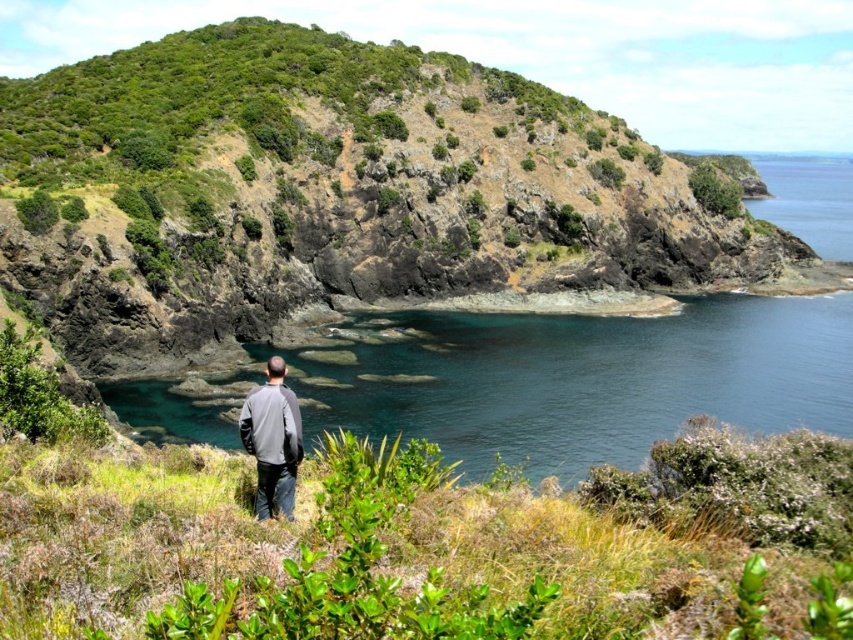
You are a photographer trying to capture the entire scene in one shot. Given that the gray fleece jacket at center and the green leafy shrub at upper center are in your frame, which object appears smaller in the photo?

The gray fleece jacket at center appears smaller than the green leafy shrub at upper center in the photo.

You are a photographer planning to capture the clear blue water at center and the gray fleece jacket at center in a single shot. Based on their positions, which object will appear larger in the photo?

The clear blue water at center will appear larger in the photo because it has a greater height compared to the gray fleece jacket at center.